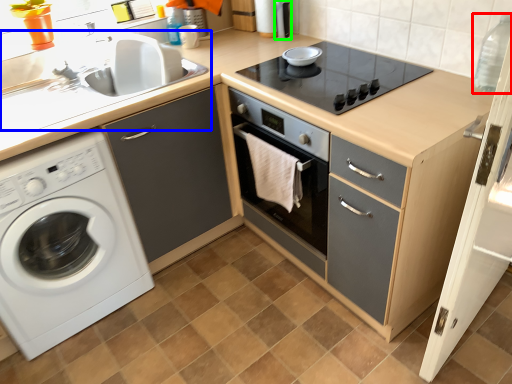
Question: Which object is positioned farthest from bottle (highlighted by a red box)? Select from sink (highlighted by a blue box) and appliance (highlighted by a green box).

Choices:
 (A) sink
 (B) appliance

Answer: (A)